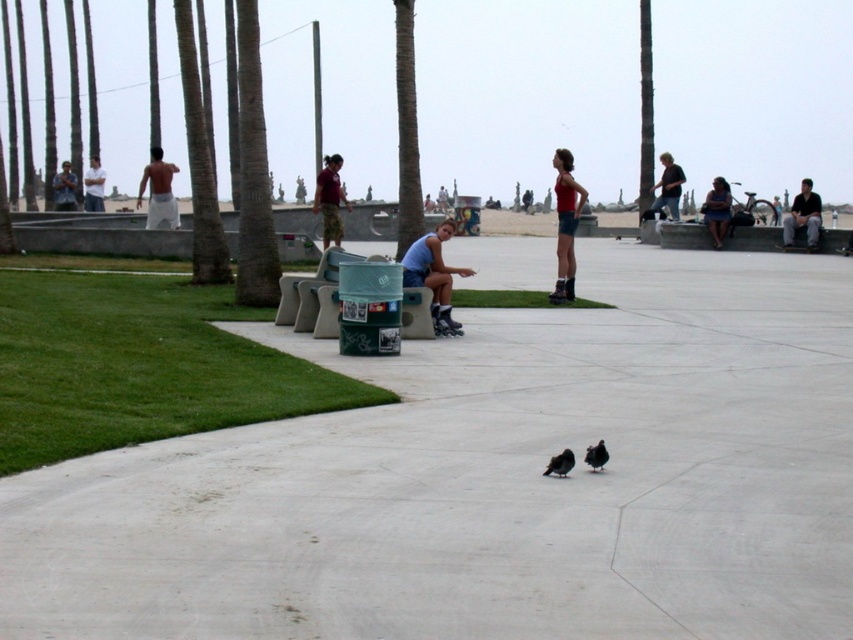
You are a photographer setting up a tripod in the park. You need to position it between the dark blue jeans at center and the dark gray shirt at right. Based on their sizes, will the tripod fit comfortably if it requires 1 meter of space between them?

The dark blue jeans at center might be wider than dark gray shirt at right, but without exact measurements, it is uncertain if the 1 meter space is sufficient. Check the actual distance before placing the tripod.

You are a photographer standing at the park entrance. You want to take a photo that includes both the green textured palm tree at left and the camouflage shirt at left. Which object should you focus on first to ensure both are in sharp focus?

The green textured palm tree at left is closer to the viewer than the camouflage shirt at left. To ensure both are in sharp focus, you should focus on the green textured palm tree at left first, as it is the closer object.